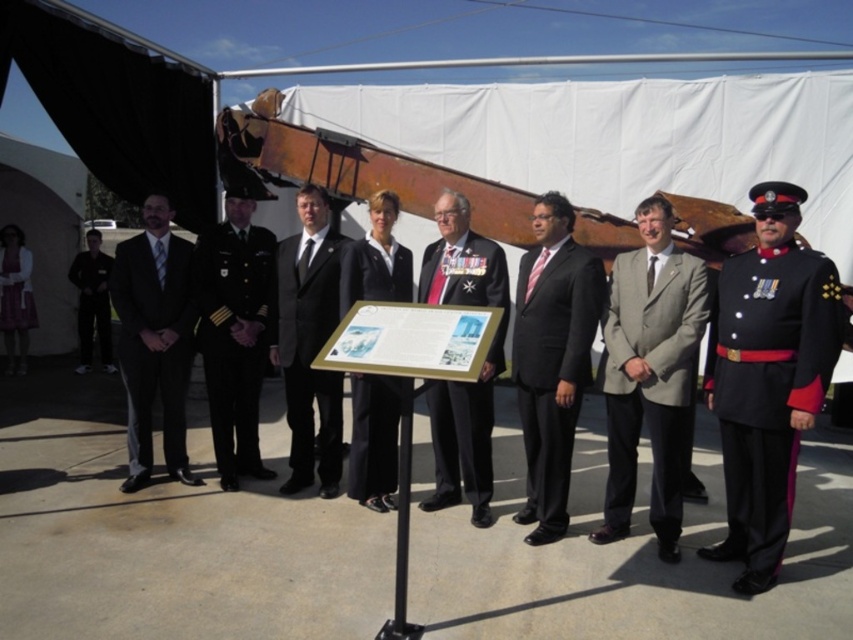
Question: Does gray wool suit at center appear on the left side of dark gray pinstripe suit at left?

Choices:
 (A) no
 (B) yes

Answer: (A)

Question: Among these points, which one is nearest to the camera?

Choices:
 (A) (317, 211)
 (B) (548, 296)
 (C) (471, 410)

Answer: (B)

Question: Is gray wool suit at center to the left of black uniform at center from the viewer's perspective?

Choices:
 (A) no
 (B) yes

Answer: (A)

Question: Does black suit at center have a lesser width compared to black smooth suit at center?

Choices:
 (A) no
 (B) yes

Answer: (A)

Question: Based on their relative distances, which object is nearer to the black satin tie at center?

Choices:
 (A) gray wool suit at center
 (B) black uniform at left

Answer: (A)

Question: Which of the following is the closest to the observer?

Choices:
 (A) black satin suit at center
 (B) black smooth suit at center

Answer: (B)